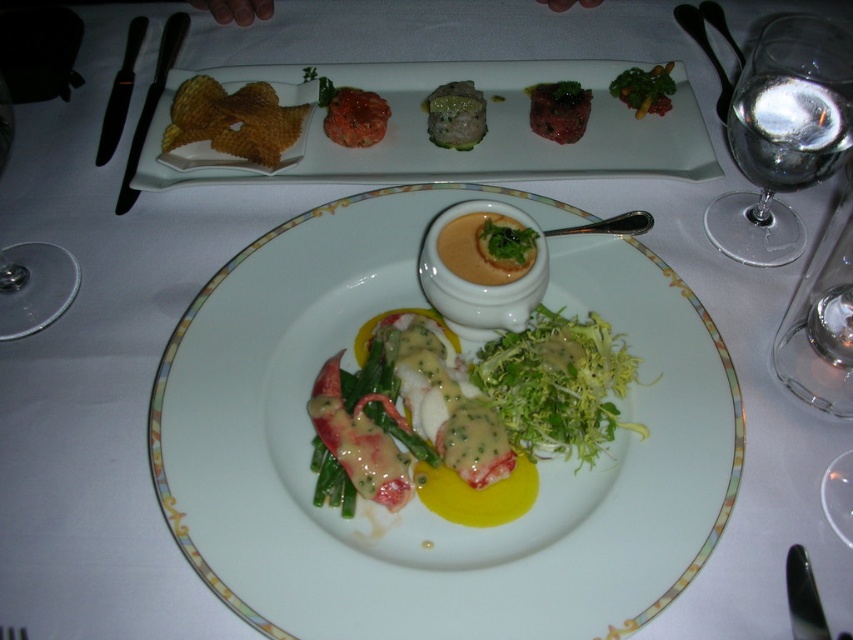
You are a food critic standing at the edge of the table. You need to describe the location of the point marked at coordinates (505, 243) relative to the main plate and the rectangular plate in the background. Which plate is it closer to?

The point marked at coordinates (505, 243) is on the green leafy vegetable at center, which is on the main round white plate with decorative border. Therefore, it is closer to the main plate than the rectangular plate in the background.

You are a food critic sitting at the table. You need to reach for the tartar on the rectangular plate in the background. Which of the two points, point (796, 92) or point (514, 232), is closer to your hand?

Point (796, 92) is further to the camera than point (514, 232), so the point (514, 232) is closer to your hand.

You are a food critic who needs to taste the green leafy vegetable at center and the transparent glass at left. The utensils are 10 inches long. Can you reach both items without moving your hand?

The distance between the transparent glass at left and the green leafy vegetable at center is 11.09 inches. Since the utensils are 10 inches long, you cannot reach both items without moving your hand because the distance is greater than the utensil length.